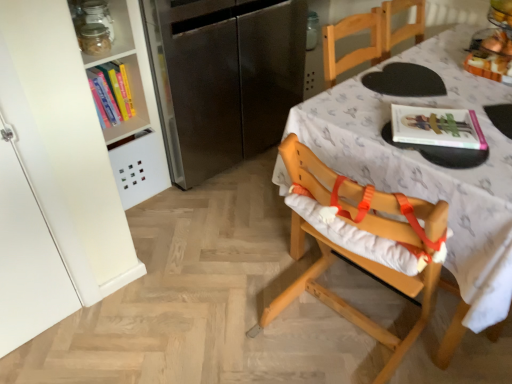
This screenshot has height=384, width=512. What are the coordinates of `vacant space behind matte pink magazine at upper right` in the screenshot? It's located at (412, 99).